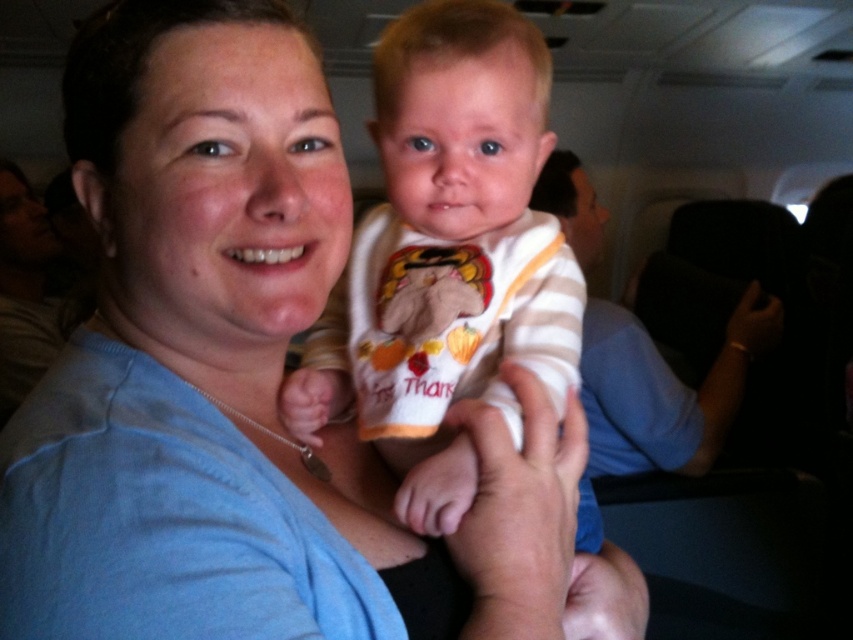
You are a flight attendant on an airplane. You need to hand a toy to the baby. The toy is currently placed on the tray table of the blue cotton shirt at center. To reach the toy, do you need to move to the left or right side of the striped fabric baby at center?

The blue cotton shirt at center is to the left of the striped fabric baby at center, so to reach the toy on the blue cotton shirt at center, you need to move to the left side of the striped fabric baby at center.

You are a flight attendant preparing to serve drinks. You need to hand a bottle to the striped fabric baby at center, but there is a blue cotton shirt at center in the way. Can you reach the baby without moving the shirt?

The blue cotton shirt at center is in front of striped fabric baby at center, so the flight attendant cannot reach the baby without moving the shirt.